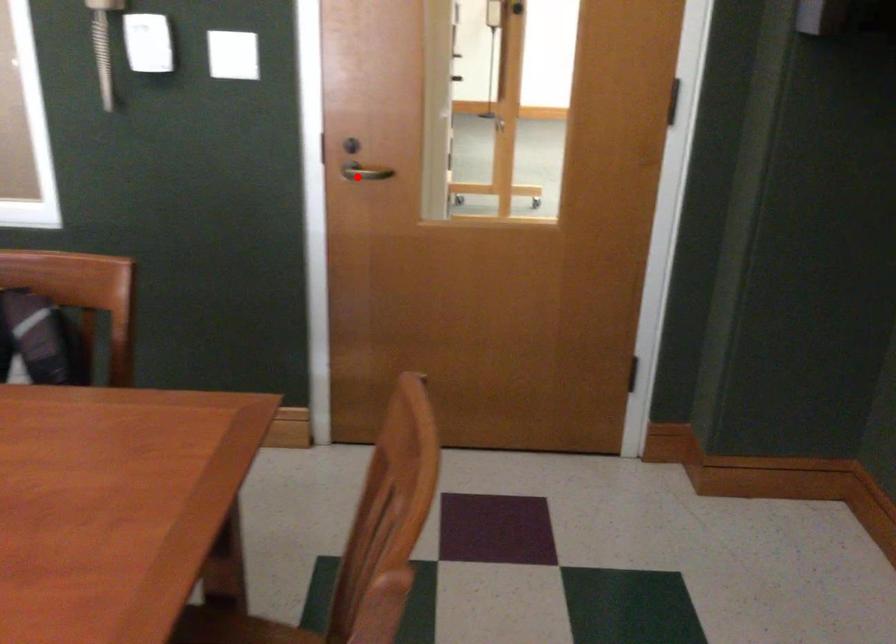
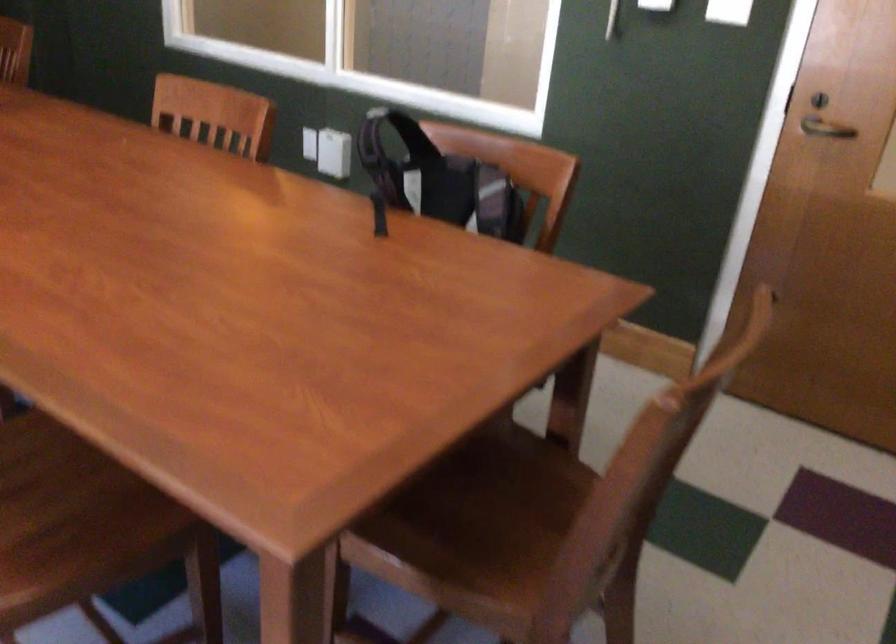
Where in the second image is the point corresponding to the highlighted location from the first image?

(824, 129)